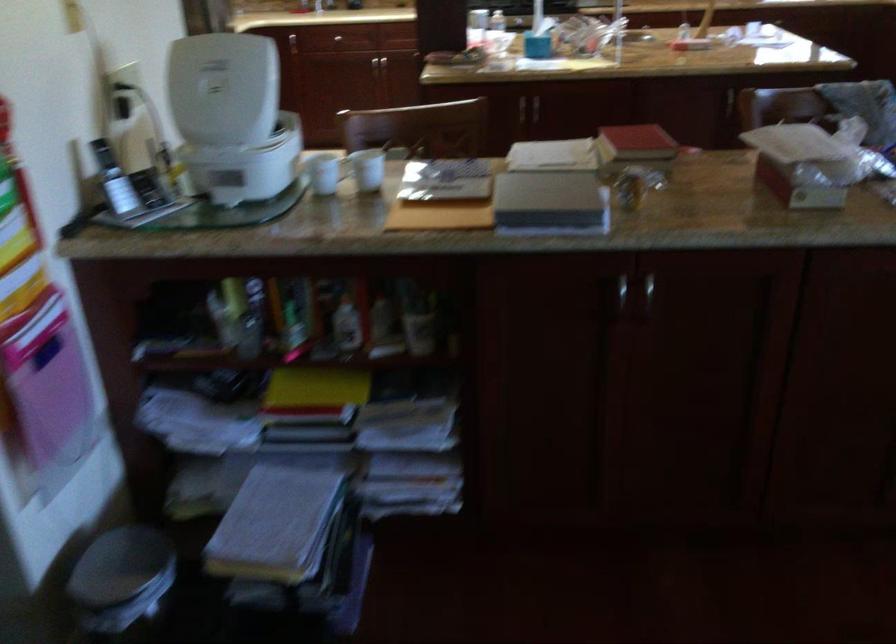
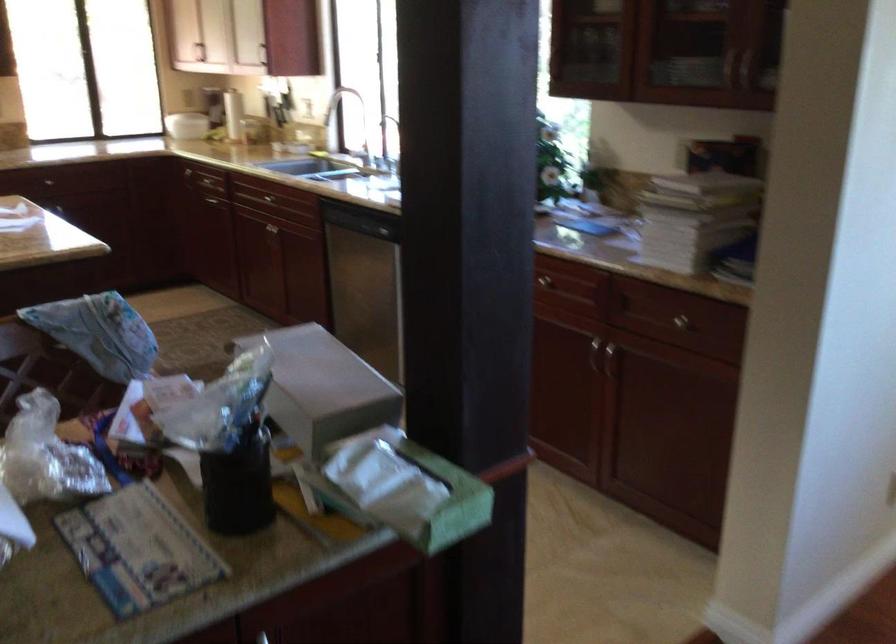
Question: How did the camera likely rotate?

Choices:
 (A) Left
 (B) Right
 (C) Up
 (D) Down

Answer: (B)